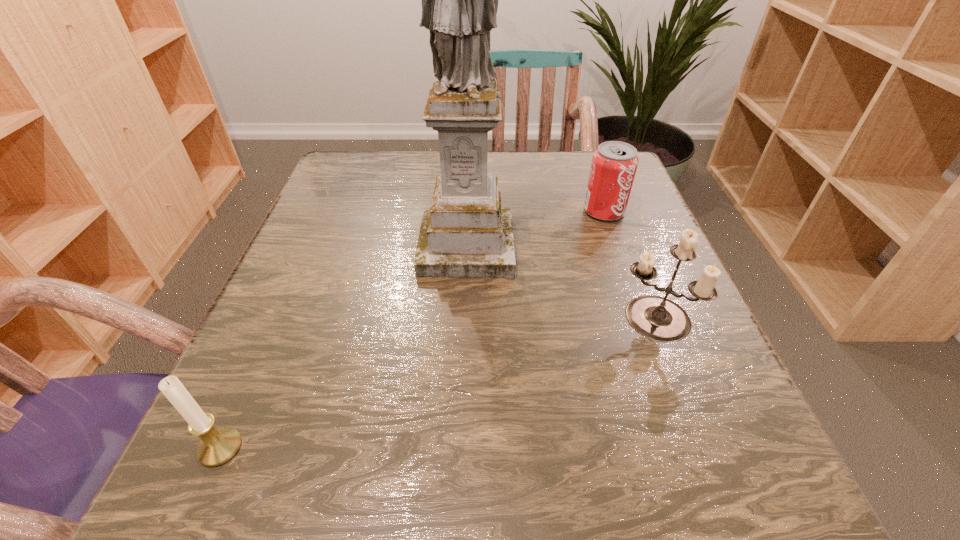
The width and height of the screenshot is (960, 540). What are the coordinates of `the tallest object` in the screenshot? It's located at (465, 233).

Locate an element on the screen. the second object from left to right is located at coordinates (465, 233).

Where is `the second nearest object`? The image size is (960, 540). the second nearest object is located at coordinates (657, 318).

Locate an element on the screen. the right candle holder is located at coordinates point(657,318).

The width and height of the screenshot is (960, 540). I want to click on soda can, so click(614, 164).

Locate an element on the screen. Image resolution: width=960 pixels, height=540 pixels. the nearest object is located at coordinates (217, 446).

The image size is (960, 540). I want to click on the left candle holder, so click(217, 446).

This screenshot has height=540, width=960. What are the coordinates of `vacant region located on the front-facing side of the sculpture` in the screenshot? It's located at (464, 335).

Where is `vacant space located 0.400m on the left of the right candle holder`? vacant space located 0.400m on the left of the right candle holder is located at coordinates (371, 318).

Where is `vacant space located on the front of the soda can`? Image resolution: width=960 pixels, height=540 pixels. vacant space located on the front of the soda can is located at coordinates (629, 280).